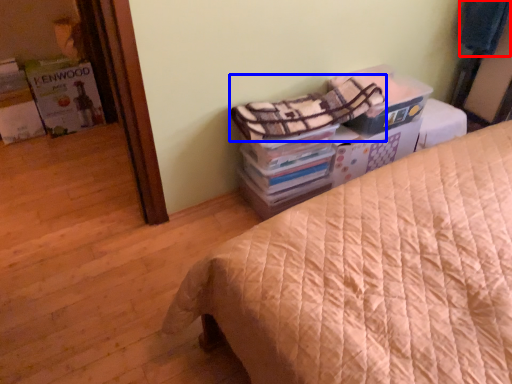
Question: Which of the following is the farthest to the observer, blanket (highlighted by a red box) or blanket (highlighted by a blue box)?

Choices:
 (A) blanket
 (B) blanket

Answer: (A)